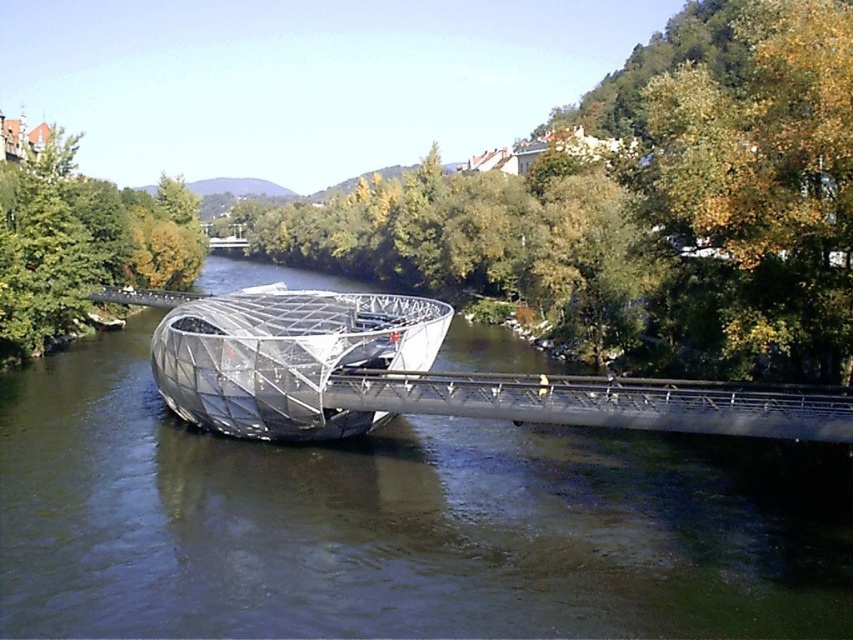
Question: Can you confirm if clear water at bridge center is positioned below transparent glass boat at center?

Choices:
 (A) yes
 (B) no

Answer: (A)

Question: Is the position of clear water at bridge center less distant than that of transparent glass boat at center?

Choices:
 (A) yes
 (B) no

Answer: (A)

Question: Where is clear water at bridge center located in relation to transparent glass boat at center in the image?

Choices:
 (A) left
 (B) right

Answer: (B)

Question: Which of the following is the closest to the observer?

Choices:
 (A) transparent glass boat at center
 (B) clear water at bridge center

Answer: (B)

Question: Which of the following is the farthest from the observer?

Choices:
 (A) (241, 360)
 (B) (703, 608)

Answer: (A)